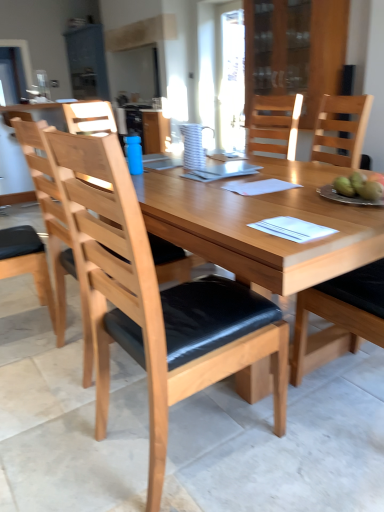
Question: Considering the relative sizes of green matte apples at right and natural wood chair at right, positioned as the first chair in right-to-left order, in the image provided, is green matte apples at right thinner than natural wood chair at right, positioned as the first chair in right-to-left order,?

Choices:
 (A) no
 (B) yes

Answer: (B)

Question: Does green matte apples at right contain natural wood chair at right, which is the third chair from left to right?

Choices:
 (A) no
 (B) yes

Answer: (A)

Question: Does green matte apples at right have a smaller size compared to natural wood chair at right, positioned as the first chair in right-to-left order?

Choices:
 (A) yes
 (B) no

Answer: (A)

Question: Is green matte apples at right at the left side of natural wood chair at right, positioned as the first chair in right-to-left order?

Choices:
 (A) no
 (B) yes

Answer: (B)

Question: Does green matte apples at right have a greater width compared to natural wood chair at right, positioned as the first chair in right-to-left order?

Choices:
 (A) yes
 (B) no

Answer: (B)

Question: Is green matte apples at right looking in the opposite direction of natural wood chair at right, which is the third chair from left to right?

Choices:
 (A) yes
 (B) no

Answer: (A)

Question: Is metallic silver plate at right at the right side of transparent glass cabinet at upper center?

Choices:
 (A) yes
 (B) no

Answer: (B)

Question: Is metallic silver plate at right beside transparent glass cabinet at upper center?

Choices:
 (A) no
 (B) yes

Answer: (A)

Question: Is metallic silver plate at right taller than transparent glass cabinet at upper center?

Choices:
 (A) yes
 (B) no

Answer: (B)

Question: Can you confirm if metallic silver plate at right is shorter than transparent glass cabinet at upper center?

Choices:
 (A) yes
 (B) no

Answer: (A)

Question: Is metallic silver plate at right outside transparent glass cabinet at upper center?

Choices:
 (A) yes
 (B) no

Answer: (A)

Question: From the image's perspective, is metallic silver plate at right under transparent glass cabinet at upper center?

Choices:
 (A) yes
 (B) no

Answer: (A)

Question: Does white striped pitcher at center have a lesser height compared to blue matte bottle at center?

Choices:
 (A) no
 (B) yes

Answer: (A)